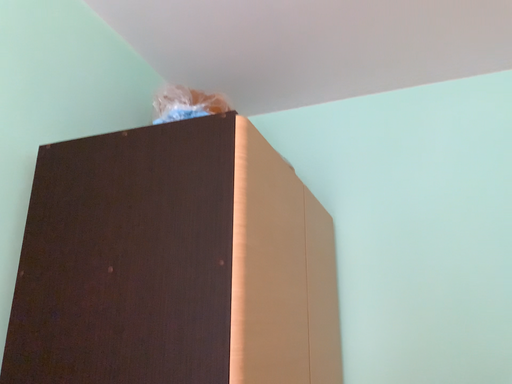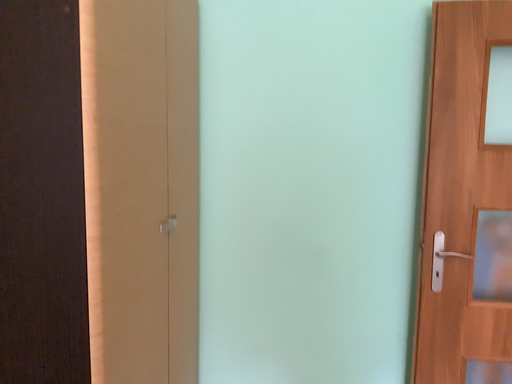
Question: How did the camera likely rotate when shooting the video?

Choices:
 (A) rotated right
 (B) rotated left

Answer: (A)